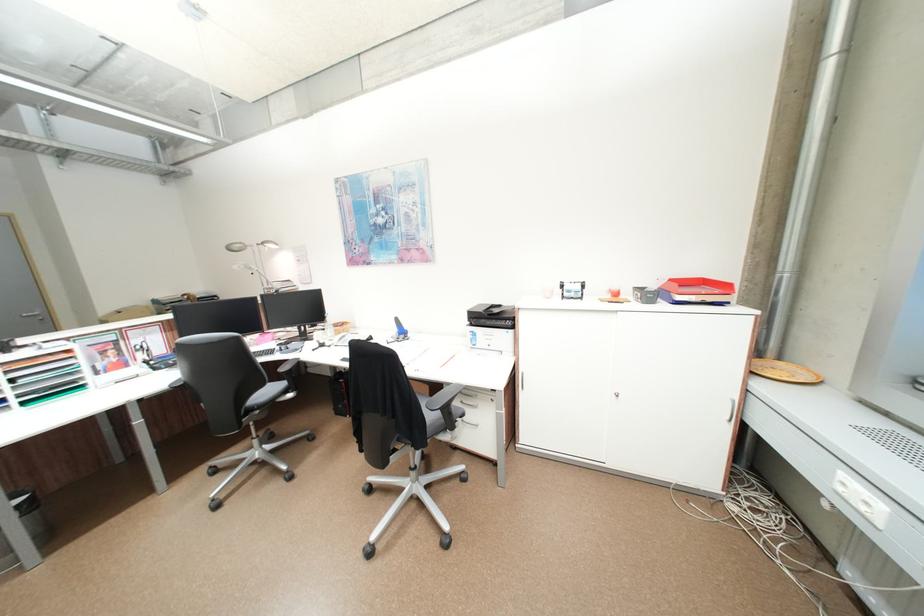
I want to click on white cabinet handle, so click(736, 405).